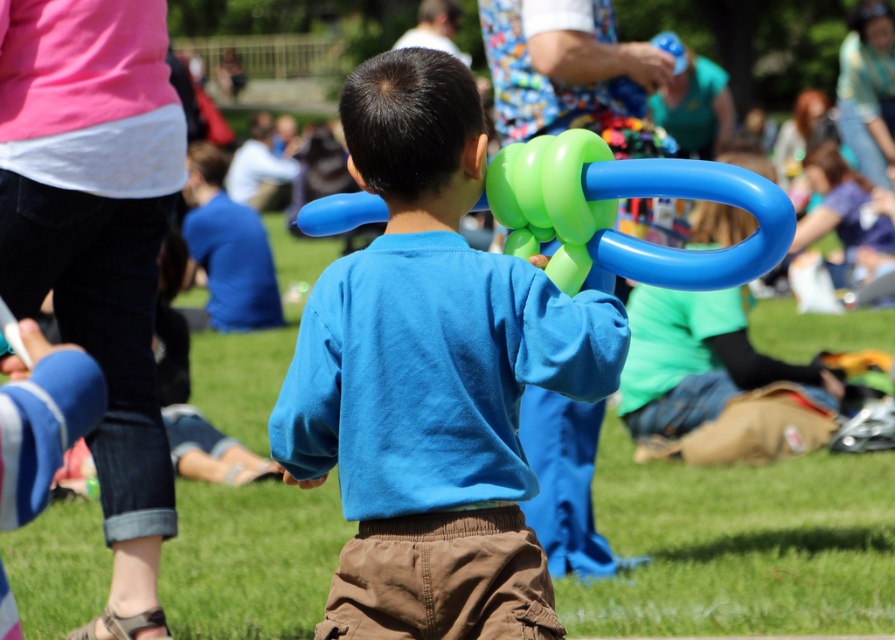
The scene shows a young boy holding a colorful balloon sculpture. There is a specific point marked at coordinates (432,376). What object is located at this point?

The point at (432,376) marks the blue matte balloon at center.

You are a child holding the blue matte balloon at center and the green rubber balloon at center. Which balloon do you feel is wider in your hand?

The green rubber balloon at center is wider than the blue matte balloon at center, so you would feel the green rubber balloon at center is wider in your hand.

In the scene shown: You are a child at the park holding both the blue matte balloon at center and the green rubber balloon at center. Which balloon is taller?

The blue matte balloon at center is taller than the green rubber balloon at center.